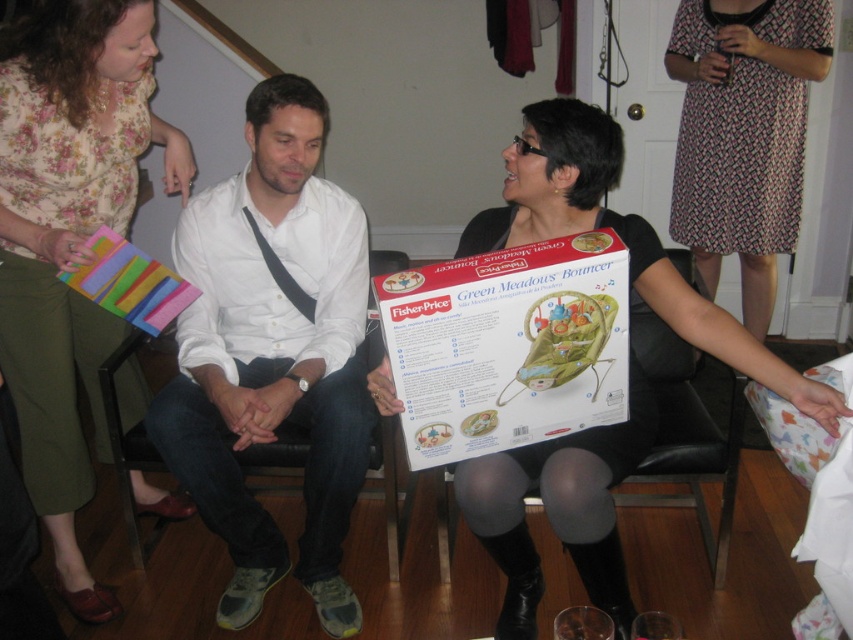
Question: Does floral fabric blouse at upper left have a smaller size compared to floral dress at upper right?

Choices:
 (A) yes
 (B) no

Answer: (B)

Question: Does matte black bouncer at center have a lesser width compared to floral dress at upper right?

Choices:
 (A) no
 (B) yes

Answer: (A)

Question: Based on their relative distances, which object is farther from the floral fabric blouse at upper left?

Choices:
 (A) matte black bouncer at center
 (B) black leather armchair at center
 (C) floral dress at upper right
 (D) white cardboard box at center

Answer: (C)

Question: Which point is farther to the camera?

Choices:
 (A) white cardboard box at center
 (B) white matte shirt at center
 (C) floral fabric blouse at upper left
 (D) matte black bouncer at center

Answer: (B)

Question: Does floral fabric blouse at upper left appear on the right side of black leather armchair at center?

Choices:
 (A) no
 (B) yes

Answer: (A)

Question: Which point is farther to the camera?

Choices:
 (A) (577, 424)
 (B) (722, 42)
 (C) (645, 454)
 (D) (229, 435)

Answer: (B)